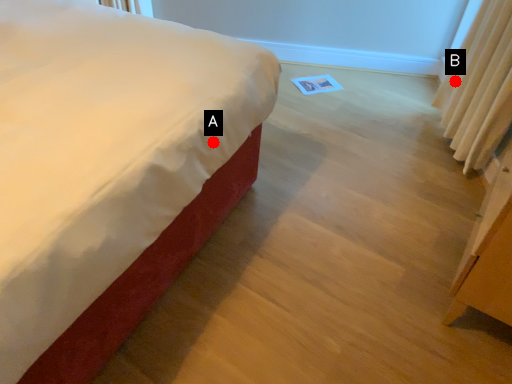
Question: Two points are circled on the image, labeled by A and B beside each circle. Which point is closer to the camera?

Choices:
 (A) A is closer
 (B) B is closer

Answer: (A)